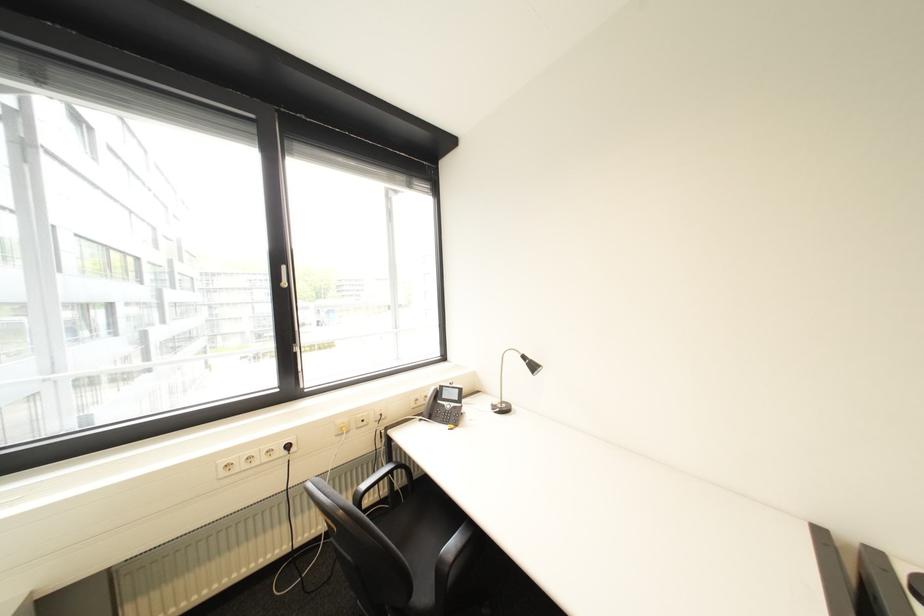
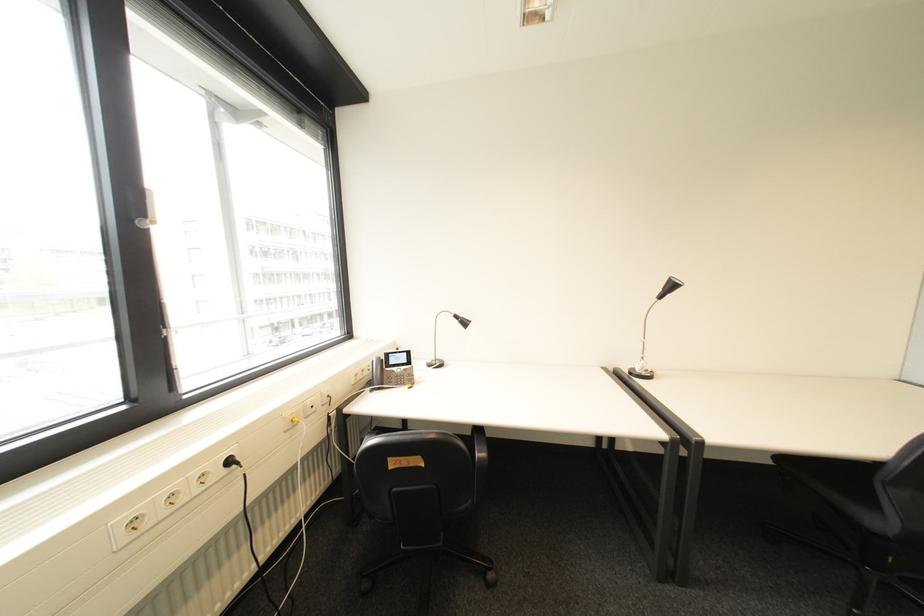
Find the pixel in the second image that matches point (448, 402) in the first image.

(396, 370)